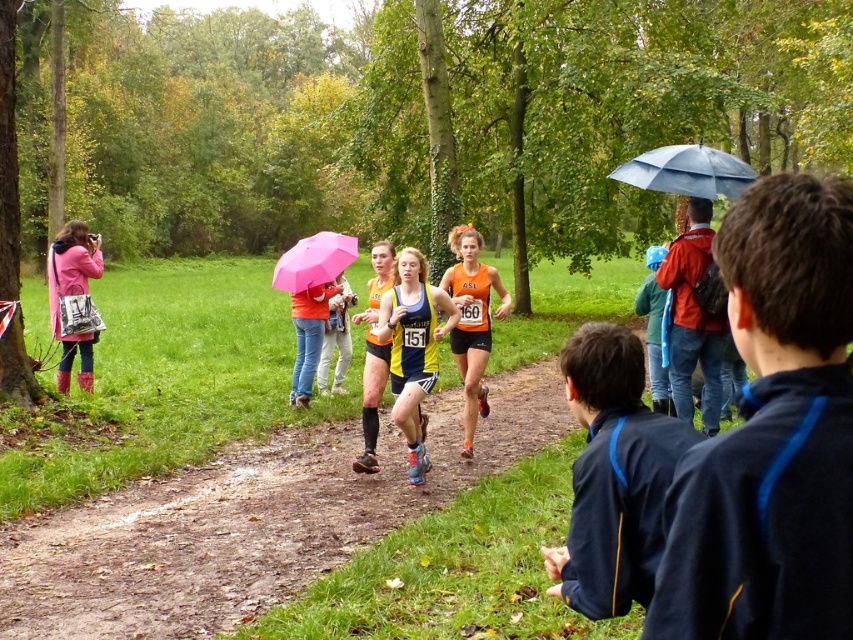
Image resolution: width=853 pixels, height=640 pixels. What do you see at coordinates (248, 522) in the screenshot? I see `dirt path at center` at bounding box center [248, 522].

Who is shorter, dirt path at center or orange matte running suit at center?

With less height is dirt path at center.

Who is more forward, (291,550) or (440,282)?

Positioned in front is point (291,550).

The image size is (853, 640). What are the coordinates of `dirt path at center` in the screenshot? It's located at (248, 522).

Between yellow and blue athletic suit at center and blue fabric umbrella at upper right, which one is positioned higher?

blue fabric umbrella at upper right is above.

Between yellow and blue athletic suit at center and blue fabric umbrella at upper right, which one appears on the right side from the viewer's perspective?

Positioned to the right is blue fabric umbrella at upper right.

This screenshot has height=640, width=853. What are the coordinates of `yellow and blue athletic suit at center` in the screenshot? It's located at (412, 348).

Is the position of blue fabric umbrella at upper right more distant than that of orange athletic shorts at center?

No, it is in front of orange athletic shorts at center.

Is blue fabric umbrella at upper right below orange athletic shorts at center?

Actually, blue fabric umbrella at upper right is above orange athletic shorts at center.

Who is more forward, (x=718, y=170) or (x=369, y=307)?

Point (x=718, y=170)

Locate an element on the screen. blue fabric umbrella at upper right is located at coordinates (688, 172).